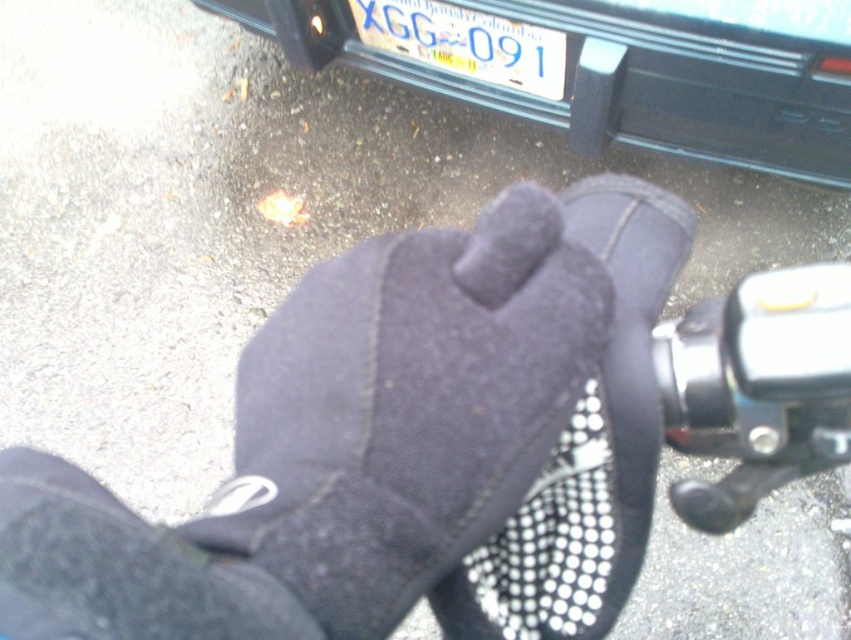
Does black suede glove at center appear over white plastic license plate at center?

Incorrect, black suede glove at center is not positioned above white plastic license plate at center.

Can you confirm if black suede glove at center is positioned to the right of white plastic license plate at center?

Incorrect, black suede glove at center is not on the right side of white plastic license plate at center.

Who is more distant from viewer, (511, 216) or (543, 96)?

The point (543, 96) is more distant.

Where is `black suede glove at center`? The height and width of the screenshot is (640, 851). black suede glove at center is located at coordinates (404, 408).

Does black fleece glove at center appear on the right side of black fleece sock at lower left?

Yes, black fleece glove at center is to the right of black fleece sock at lower left.

Between black fleece glove at center and black fleece sock at lower left, which one appears on the left side from the viewer's perspective?

black fleece sock at lower left

Describe the element at coordinates (586, 448) in the screenshot. This screenshot has height=640, width=851. I see `black fleece glove at center` at that location.

Where is `black fleece glove at center`? This screenshot has width=851, height=640. black fleece glove at center is located at coordinates (586, 448).

Is point (367, 512) closer to viewer compared to point (506, 616)?

Yes, point (367, 512) is closer to viewer.

What do you see at coordinates (404, 408) in the screenshot? I see `black suede glove at center` at bounding box center [404, 408].

The height and width of the screenshot is (640, 851). Identify the location of black suede glove at center. (404, 408).